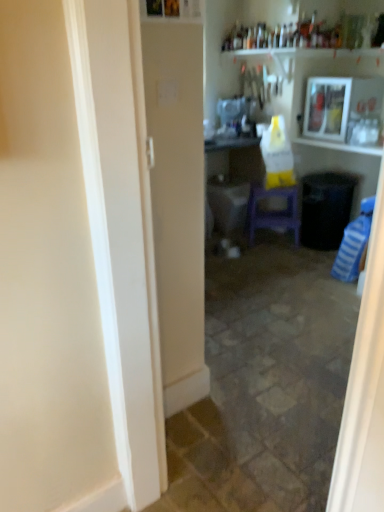
Question: Is wooden framed picture at upper right positioned behind white glossy sink at center?

Choices:
 (A) yes
 (B) no

Answer: (B)

Question: Does wooden framed picture at upper right appear on the right side of white glossy sink at center?

Choices:
 (A) yes
 (B) no

Answer: (A)

Question: Is wooden framed picture at upper right facing away from white glossy sink at center?

Choices:
 (A) yes
 (B) no

Answer: (B)

Question: From a real-world perspective, is wooden framed picture at upper right located higher than white glossy sink at center?

Choices:
 (A) no
 (B) yes

Answer: (B)

Question: Can you confirm if wooden framed picture at upper right is bigger than white glossy sink at center?

Choices:
 (A) no
 (B) yes

Answer: (B)

Question: Considering the positions of wooden framed picture at upper right and white glossy sink at center in the image, is wooden framed picture at upper right bigger or smaller than white glossy sink at center?

Choices:
 (A) small
 (B) big

Answer: (B)

Question: In the image, is wooden framed picture at upper right positioned in front of or behind white glossy sink at center?

Choices:
 (A) front
 (B) behind

Answer: (A)

Question: From a real-world perspective, is wooden framed picture at upper right physically located above or below white glossy sink at center?

Choices:
 (A) below
 (B) above

Answer: (B)

Question: Is wooden framed picture at upper right situated inside white glossy sink at center or outside?

Choices:
 (A) outside
 (B) inside

Answer: (A)

Question: Looking at the image, does wooden framed picture at upper right seem bigger or smaller compared to purple plastic stool at center?

Choices:
 (A) big
 (B) small

Answer: (A)

Question: From a real-world perspective, relative to purple plastic stool at center, is wooden framed picture at upper right vertically above or below?

Choices:
 (A) below
 (B) above

Answer: (B)

Question: Visually, is wooden framed picture at upper right positioned to the left or to the right of purple plastic stool at center?

Choices:
 (A) right
 (B) left

Answer: (A)

Question: Considering the positions of wooden framed picture at upper right and purple plastic stool at center in the image, is wooden framed picture at upper right wider or thinner than purple plastic stool at center?

Choices:
 (A) wide
 (B) thin

Answer: (A)

Question: From the image's perspective, relative to wooden framed picture at upper right, is purple plastic stool at center above or below?

Choices:
 (A) above
 (B) below

Answer: (B)

Question: Based on their positions, is purple plastic stool at center located to the left or right of wooden framed picture at upper right?

Choices:
 (A) right
 (B) left

Answer: (B)